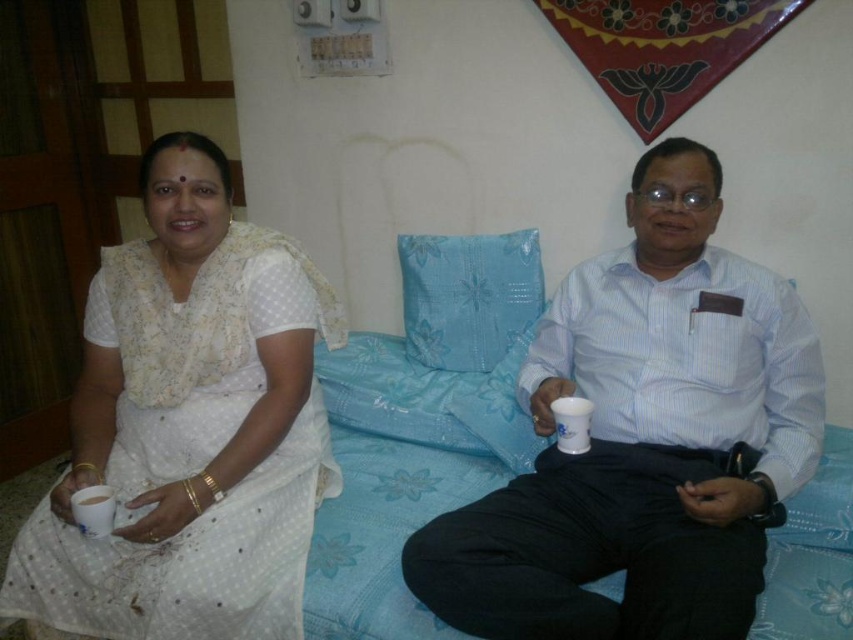
Question: Which point appears farthest from the camera in this image?

Choices:
 (A) (773, 490)
 (B) (271, 314)

Answer: (B)

Question: From the image, what is the correct spatial relationship of white glossy shirt at center in relation to blue floral fabric pillow at center?

Choices:
 (A) above
 (B) below

Answer: (B)

Question: Based on their relative distances, which object is nearer to the blue floral fabric pillow at center?

Choices:
 (A) white paper cup at lower left
 (B) white dotted fabric at left

Answer: (B)

Question: Can you confirm if white glossy shirt at center is bigger than white paper cup at lower left?

Choices:
 (A) yes
 (B) no

Answer: (A)

Question: Among these points, which one is nearest to the camera?

Choices:
 (A) (614, 333)
 (B) (123, 438)
 (C) (96, 499)

Answer: (C)

Question: Does blue floral fabric pillow at center have a greater width compared to white paper cup at lower left?

Choices:
 (A) no
 (B) yes

Answer: (B)